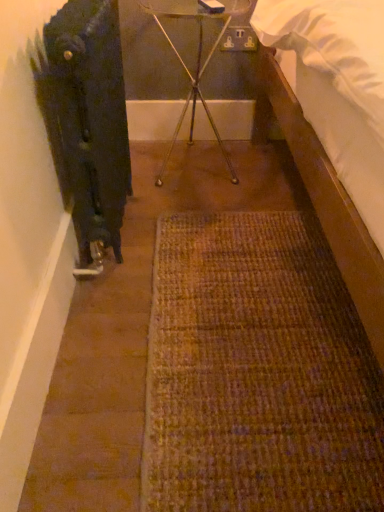
Question: Should I look upward or downward to see black matte radiator at left?

Choices:
 (A) up
 (B) down

Answer: (A)

Question: Is the position of black matte radiator at left less distant than that of metallic tripod at center?

Choices:
 (A) no
 (B) yes

Answer: (B)

Question: Does black matte radiator at left have a greater width compared to metallic tripod at center?

Choices:
 (A) no
 (B) yes

Answer: (A)

Question: Are black matte radiator at left and metallic tripod at center far apart?

Choices:
 (A) yes
 (B) no

Answer: (B)

Question: Is black matte radiator at left thinner than metallic tripod at center?

Choices:
 (A) no
 (B) yes

Answer: (B)

Question: From a real-world perspective, is black matte radiator at left physically below metallic tripod at center?

Choices:
 (A) no
 (B) yes

Answer: (A)

Question: From a real-world perspective, is black matte radiator at left over metallic tripod at center?

Choices:
 (A) no
 (B) yes

Answer: (B)

Question: Is metallic tripod at center turned away from black matte radiator at left?

Choices:
 (A) yes
 (B) no

Answer: (B)

Question: Is metallic tripod at center not close to black matte radiator at left?

Choices:
 (A) yes
 (B) no

Answer: (B)

Question: Can you confirm if metallic tripod at center is positioned to the right of black matte radiator at left?

Choices:
 (A) no
 (B) yes

Answer: (B)

Question: From the image's perspective, is metallic tripod at center below black matte radiator at left?

Choices:
 (A) no
 (B) yes

Answer: (A)

Question: Is black matte radiator at left located within metallic tripod at center?

Choices:
 (A) no
 (B) yes

Answer: (A)

Question: Does metallic tripod at center have a greater width compared to black matte radiator at left?

Choices:
 (A) no
 (B) yes

Answer: (B)

Question: Is metallic tripod at center wider or thinner than black matte radiator at left?

Choices:
 (A) thin
 (B) wide

Answer: (B)